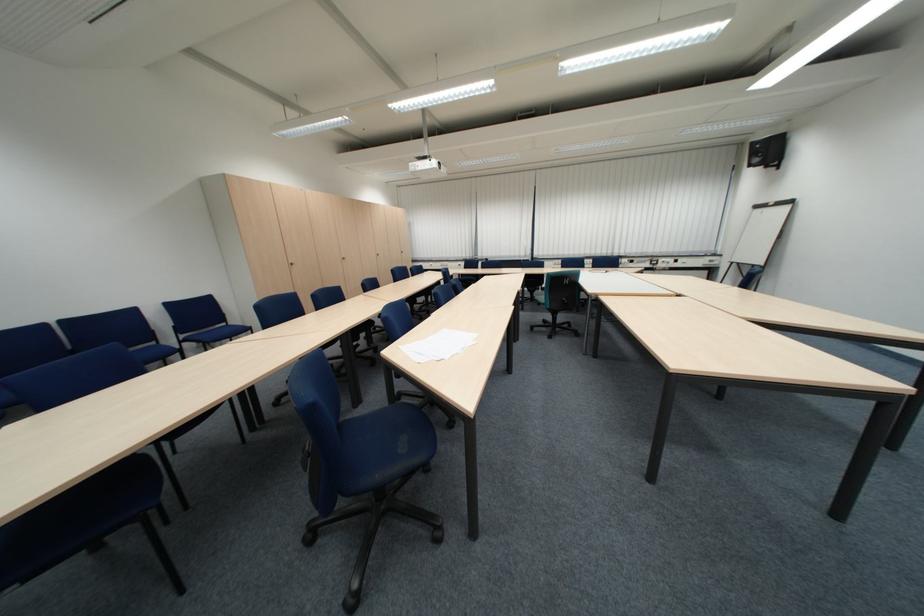
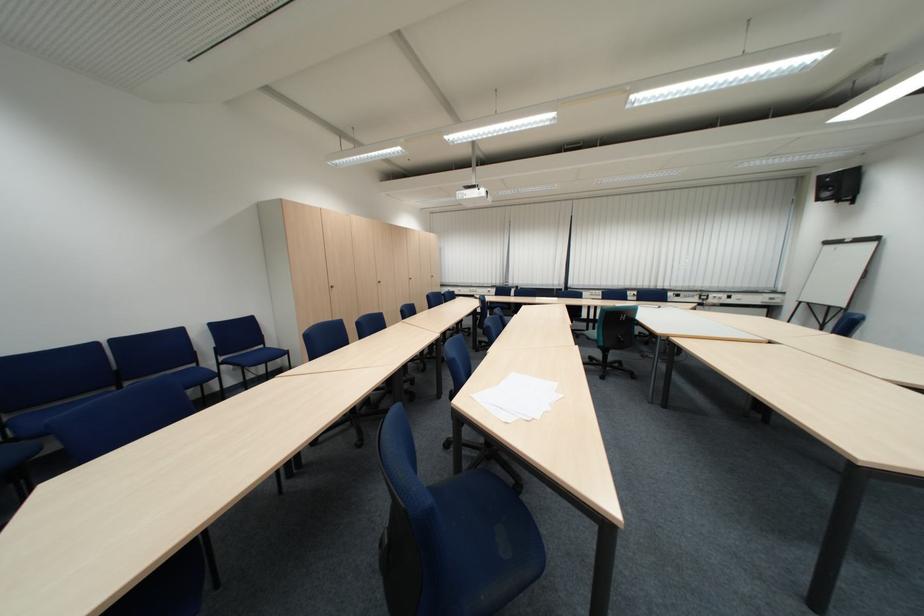
In the second image, find the point that corresponds to point 530,254 in the first image.

(564, 284)